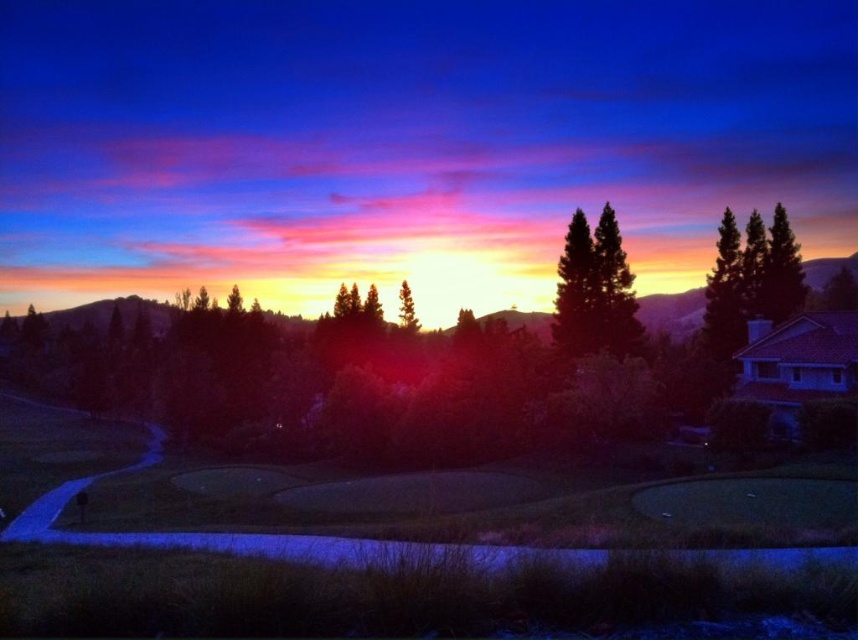
This screenshot has height=640, width=858. Find the location of `green matte tree at center`. green matte tree at center is located at coordinates (595, 291).

At what (x,y) coordinates should I click in order to perform the action: click on green matte tree at center. Please return your answer as a coordinate pair (x, y). The width and height of the screenshot is (858, 640). Looking at the image, I should click on (595, 291).

The image size is (858, 640). In order to click on green matte tree at center in this screenshot , I will do (x=595, y=291).

Is green matte tree at upper right smaller than silvery metallic tree at center?

Actually, green matte tree at upper right might be larger than silvery metallic tree at center.

Who is higher up, green matte tree at upper right or silvery metallic tree at center?

green matte tree at upper right is above.

This screenshot has height=640, width=858. What are the coordinates of `green matte tree at upper right` in the screenshot? It's located at (781, 272).

Locate an element on the screen. green matte tree at upper right is located at coordinates (781, 272).

Looking at this image, between green grassy golf course at lower center and silvery metallic tree at center, which one appears on the right side from the viewer's perspective?

From the viewer's perspective, silvery metallic tree at center appears more on the right side.

Is green grassy golf course at lower center to the right of silvery metallic tree at center from the viewer's perspective?

No, green grassy golf course at lower center is not to the right of silvery metallic tree at center.

Is point (698, 593) behind point (408, 300)?

No, it is not.

Find the location of `green grassy golf course at lower center`. green grassy golf course at lower center is located at coordinates (391, 582).